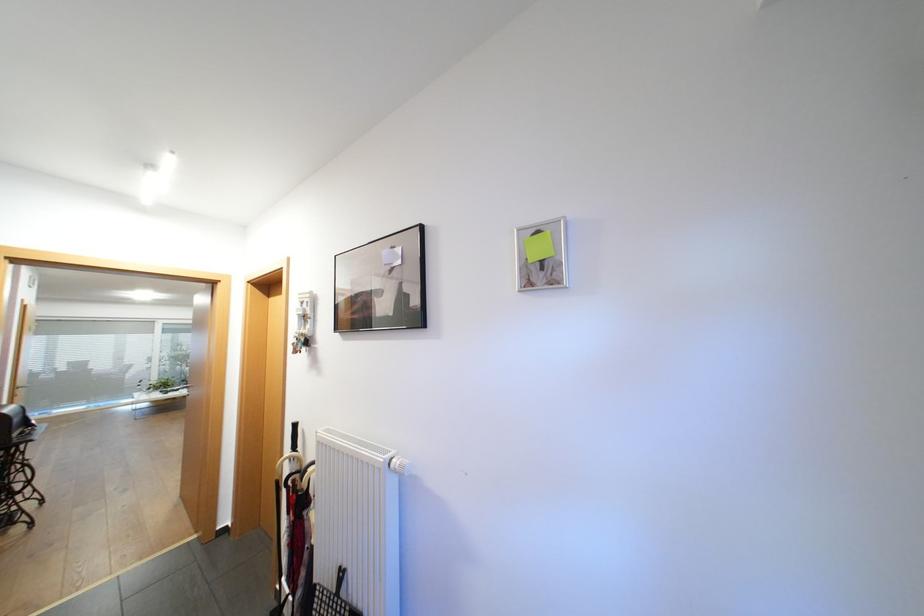
The height and width of the screenshot is (616, 924). I want to click on black umbrella handle, so click(294, 436).